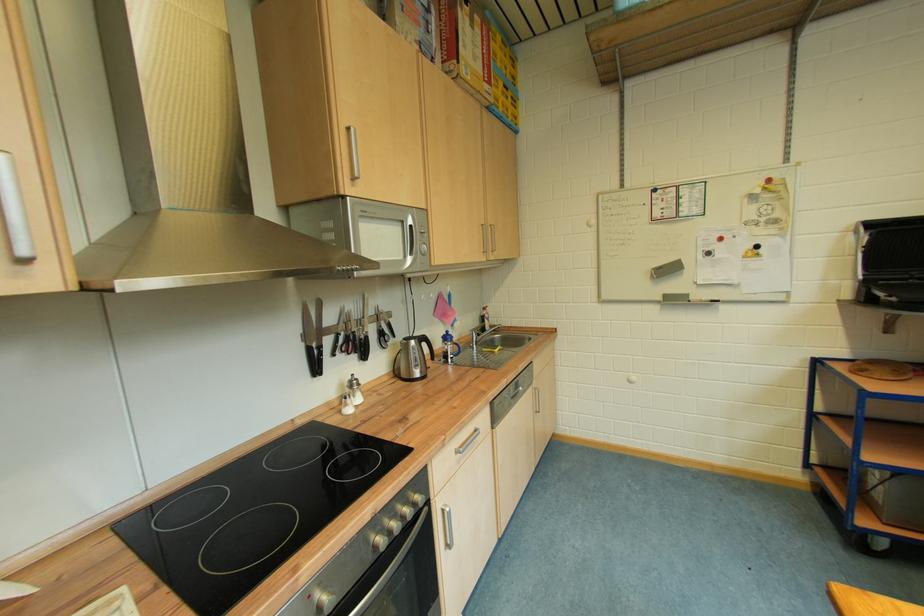
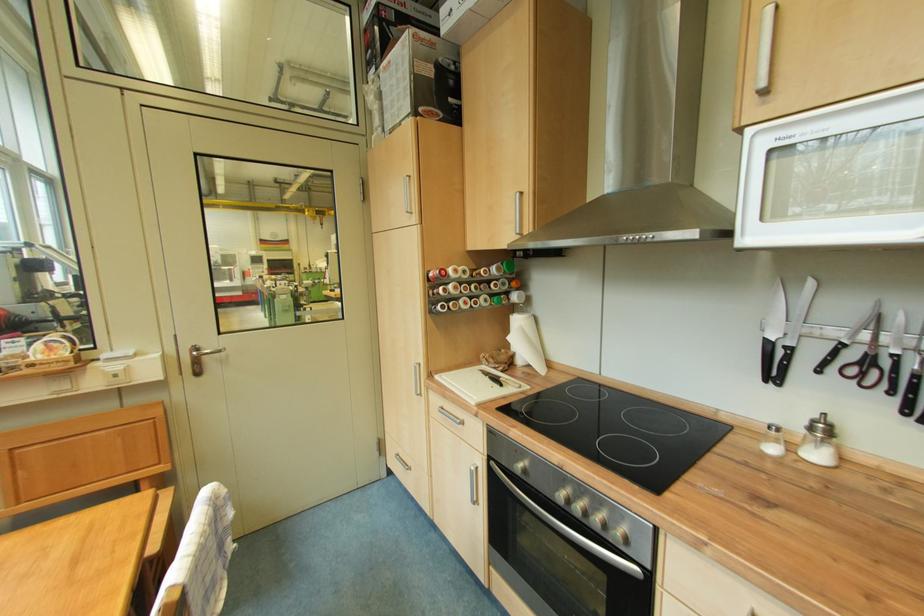
The point at (420, 533) is marked in the first image. Where is the corresponding point in the second image?

(614, 556)